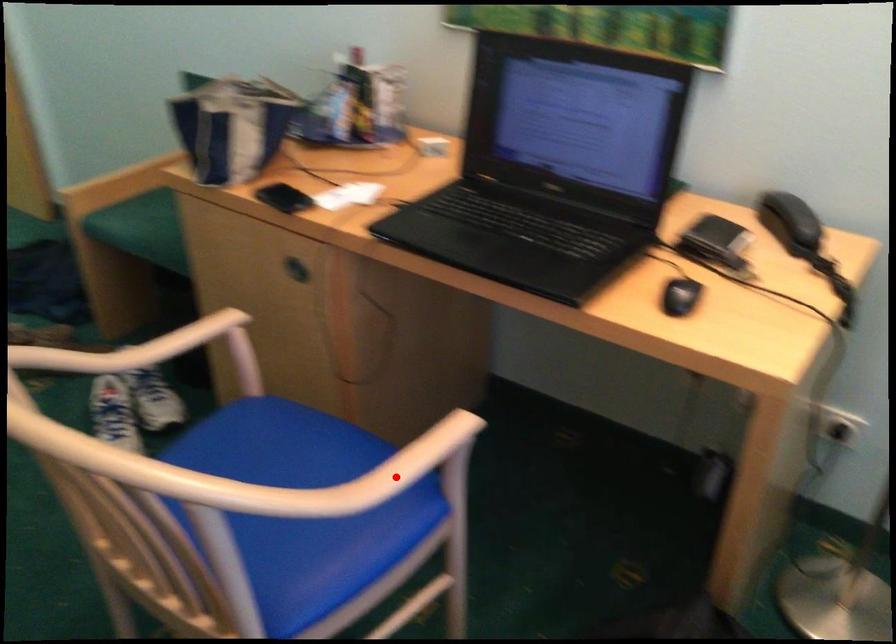
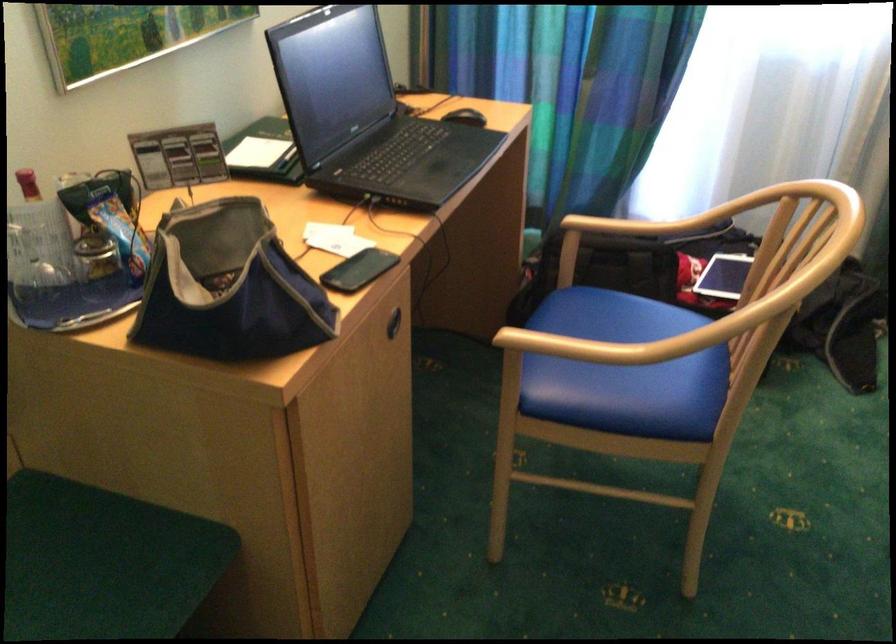
Where in the second image is the point corresponding to the highlighted location from the first image?

(647, 231)